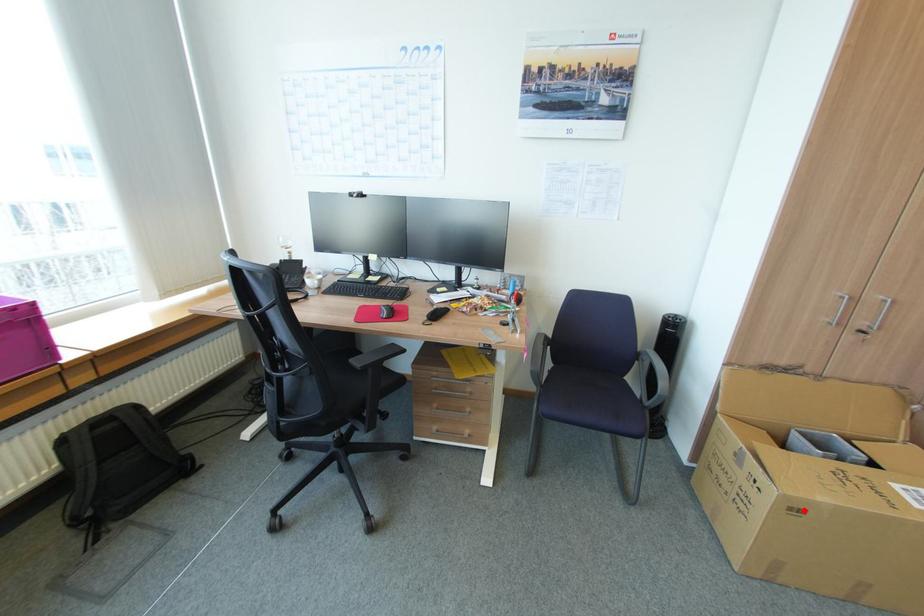
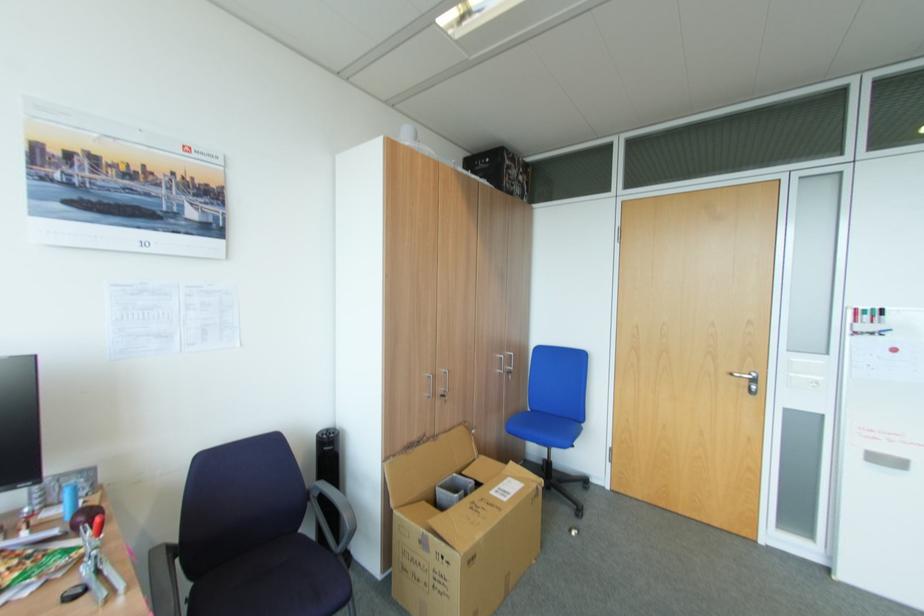
Question: I am providing you with two images of the same scene from different viewpoints. A red point is shown in image1. For the corresponding object point in image2, is it positioned nearer or farther from the camera?

Choices:
 (A) Nearer
 (B) Farther

Answer: (B)